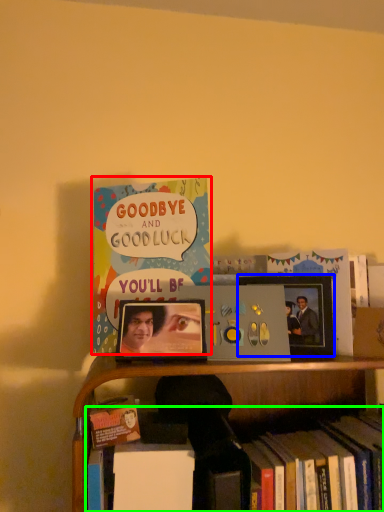
Question: Which is farther away from book (highlighted by a red box)? picture frame (highlighted by a blue box) or book (highlighted by a green box)?

Choices:
 (A) picture frame
 (B) book

Answer: (B)